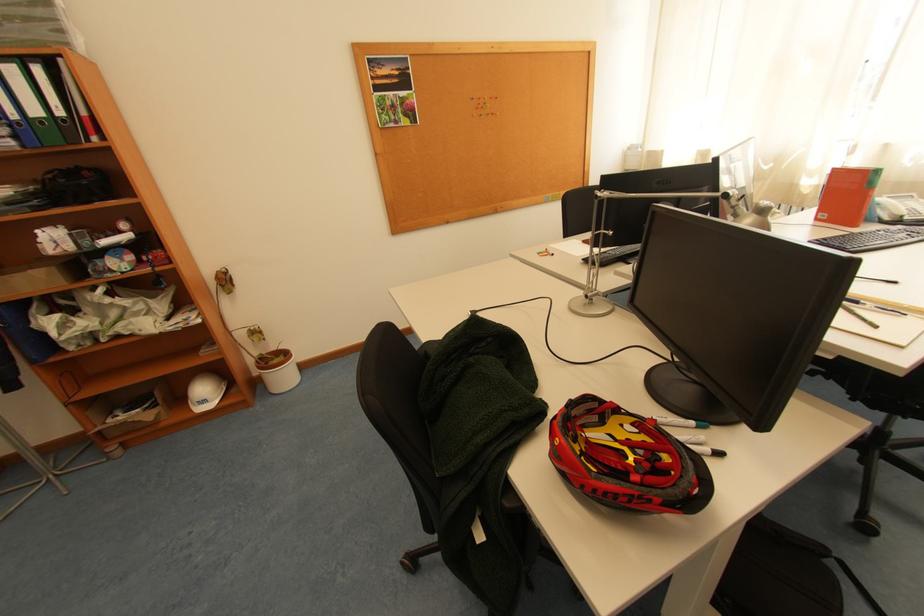
The height and width of the screenshot is (616, 924). What do you see at coordinates (872, 306) in the screenshot? I see `the black marker` at bounding box center [872, 306].